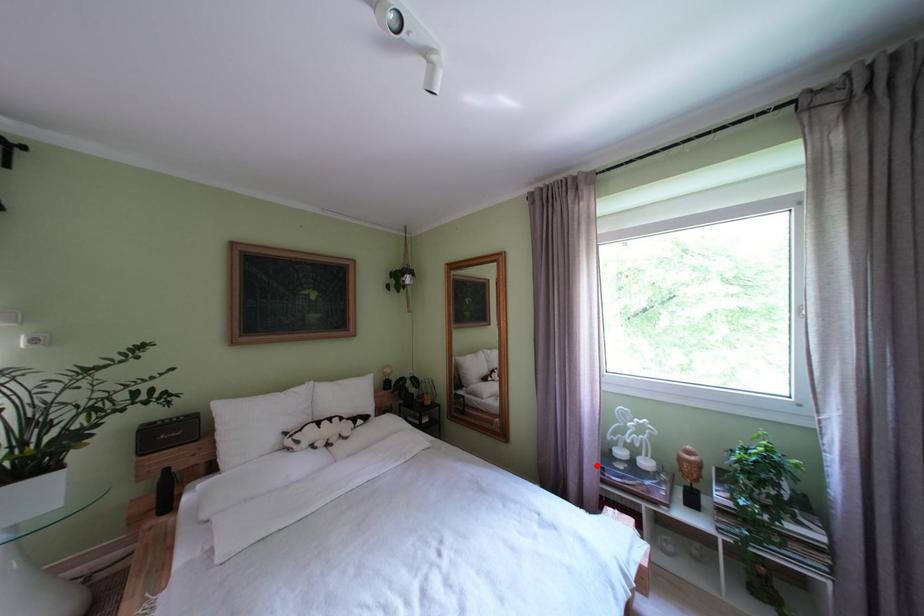
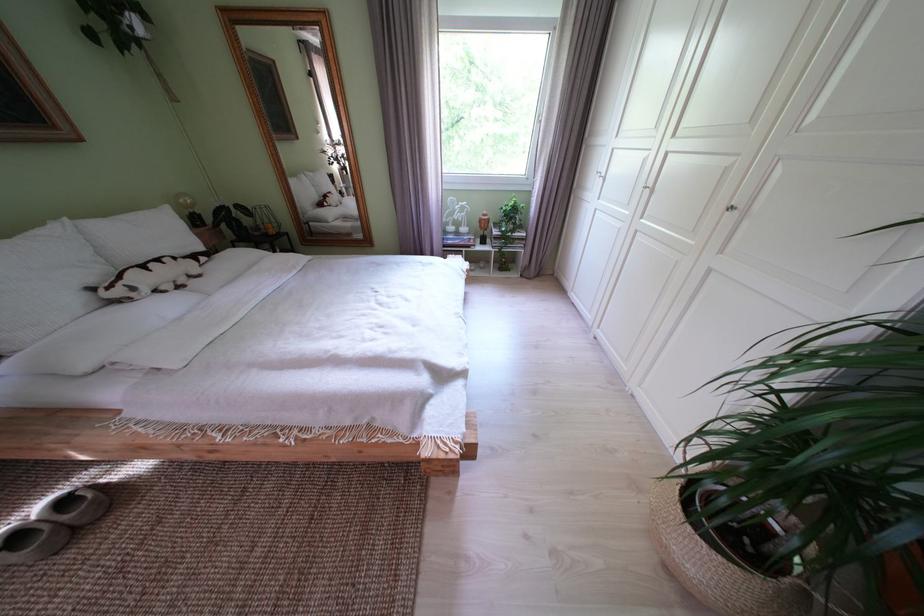
Where in the second image is the point corresponding to the highlighted location from the first image?

(445, 241)